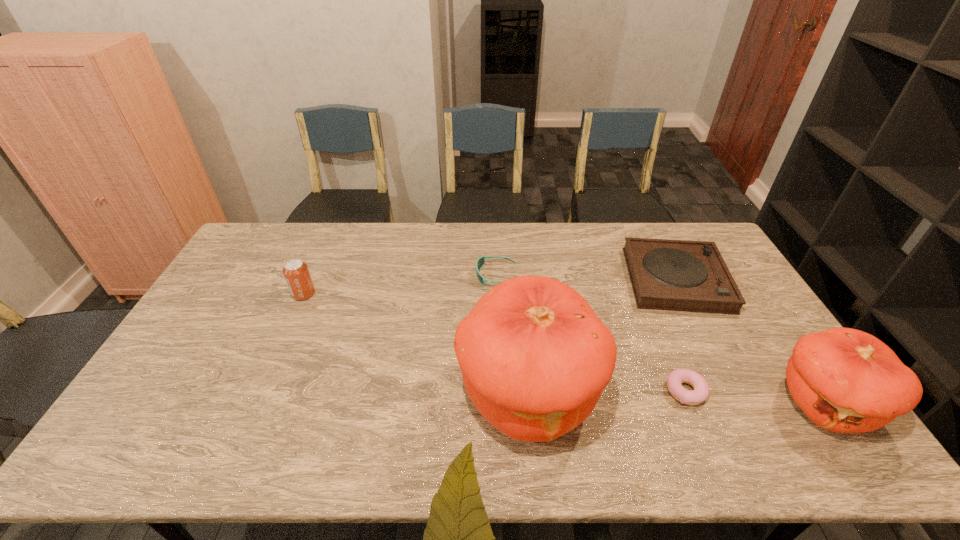
You are a GUI agent. You are given a task and a screenshot of the screen. Output one action in this format:
    pyautogui.click(x=<x>, y=<y>)
    Task: Click on the empty space that is in between the phonograph record and the fifth tallest object
    
    Given the screenshot: What is the action you would take?
    pyautogui.click(x=587, y=278)

Locate an element on the screen. vacant point located between the phonograph record and the can is located at coordinates (490, 286).

The image size is (960, 540). Find the location of `unoccupied position between the right pumpkin and the shortest object`. unoccupied position between the right pumpkin and the shortest object is located at coordinates (755, 398).

Locate an element on the screen. The height and width of the screenshot is (540, 960). empty space between the third shortest object and the second shortest object is located at coordinates (587, 278).

Where is `object that stands as the fifth closest to the right pumpkin`? The height and width of the screenshot is (540, 960). object that stands as the fifth closest to the right pumpkin is located at coordinates (296, 272).

At what (x,y) coordinates should I click in order to perform the action: click on object that is the third nearest to the second shortest object. Please return your answer as a coordinate pair (x, y). The width and height of the screenshot is (960, 540). Looking at the image, I should click on (675, 379).

At what (x,y) coordinates should I click in order to perform the action: click on vacant region that satisfies the following two spatial constraints: 1. on the front-facing side of the second shortest object; 2. on the left side of the doughnut. Please return your answer as a coordinate pair (x, y). The image size is (960, 540). Looking at the image, I should click on (501, 392).

This screenshot has height=540, width=960. I want to click on free location that satisfies the following two spatial constraints: 1. on the back side of the shortest object; 2. on the front-facing side of the second shortest object, so click(637, 275).

Find the location of `free space that satisfies the following two spatial constraints: 1. on the front-facing side of the second shortest object; 2. on the back side of the shorter pumpkin`. free space that satisfies the following two spatial constraints: 1. on the front-facing side of the second shortest object; 2. on the back side of the shorter pumpkin is located at coordinates [x=502, y=404].

Find the location of a particular element. This screenshot has width=960, height=540. free space that satisfies the following two spatial constraints: 1. on the front-facing side of the sunglasses; 2. on the left side of the left pumpkin is located at coordinates (501, 394).